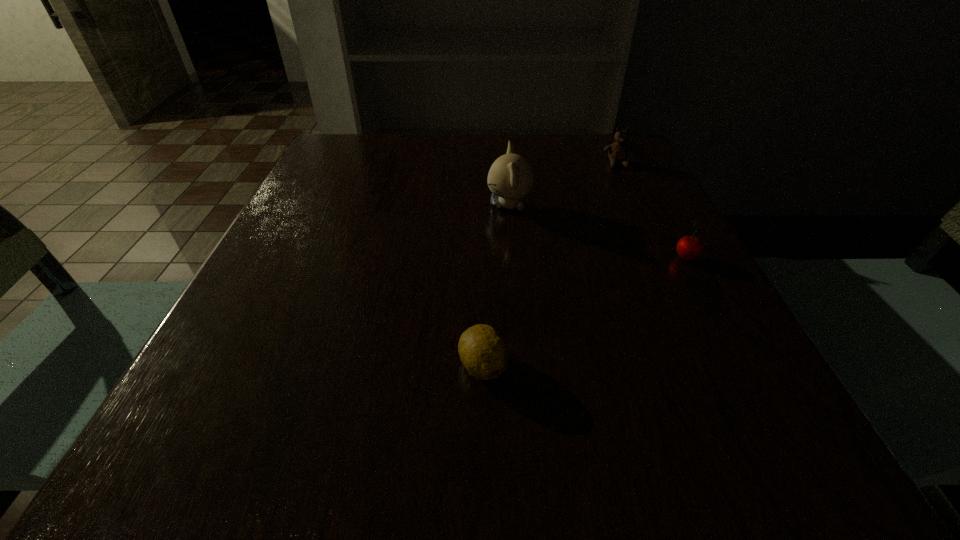
Find the location of a particular element. free space at the far left corner of the desktop is located at coordinates (362, 173).

The width and height of the screenshot is (960, 540). Find the location of `free space at the near left corner of the desktop`. free space at the near left corner of the desktop is located at coordinates (266, 484).

The width and height of the screenshot is (960, 540). In the image, there is a desktop. What are the coordinates of `vacant region at the far right corner` in the screenshot? It's located at (644, 168).

Where is `free region at the near right corner of the desktop`? The image size is (960, 540). free region at the near right corner of the desktop is located at coordinates (x=766, y=467).

Identify the location of empty location between the cherry and the shortest object. (585, 312).

This screenshot has width=960, height=540. Identify the location of free space between the second nearest object and the farthest object. (652, 212).

Identify the location of vacant area that lies between the kitten and the shortest object. The image size is (960, 540). (496, 286).

Where is `unoccupied area between the cherry and the tallest object`? This screenshot has height=540, width=960. unoccupied area between the cherry and the tallest object is located at coordinates (597, 232).

Image resolution: width=960 pixels, height=540 pixels. Identify the location of vacant area between the third farthest object and the tallest object. (597, 232).

This screenshot has width=960, height=540. Find the location of `free space between the second farthest object and the shortest object`. free space between the second farthest object and the shortest object is located at coordinates (496, 286).